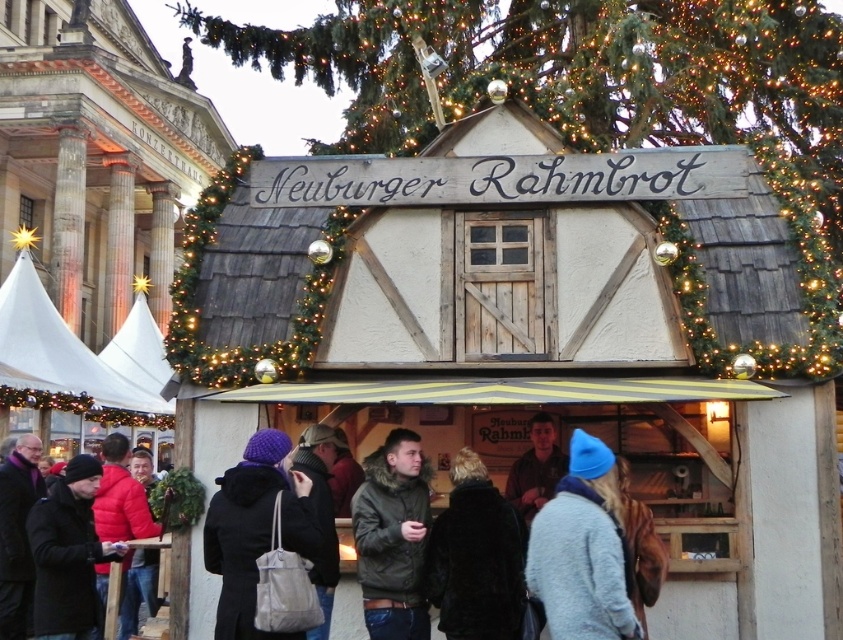
Is illuminated garland at center taller than black matte coat at lower left?

Yes, illuminated garland at center is taller than black matte coat at lower left.

Is illuminated garland at center positioned behind black matte coat at lower left?

That is True.

This screenshot has width=843, height=640. I want to click on illuminated garland at center, so click(611, 108).

Does illuminated garland at center have a lesser width compared to knitted purple hat at center?

In fact, illuminated garland at center might be wider than knitted purple hat at center.

Between illuminated garland at center and knitted purple hat at center, which one appears on the left side from the viewer's perspective?

From the viewer's perspective, knitted purple hat at center appears more on the left side.

From the picture: Who is more forward, (342,76) or (264,474)?

Point (264,474)

Find the location of a particular element. Image resolution: width=843 pixels, height=640 pixels. illuminated garland at center is located at coordinates (611, 108).

Does white fabric canopy at lower left have a smaller size compared to dark gray woolen coat at center?

Correct, white fabric canopy at lower left occupies less space than dark gray woolen coat at center.

Is white fabric canopy at lower left below dark gray woolen coat at center?

Actually, white fabric canopy at lower left is above dark gray woolen coat at center.

Who is more forward, [153,412] or [481,468]?

Point [481,468]

Where is `white fabric canopy at lower left`? white fabric canopy at lower left is located at coordinates (56, 348).